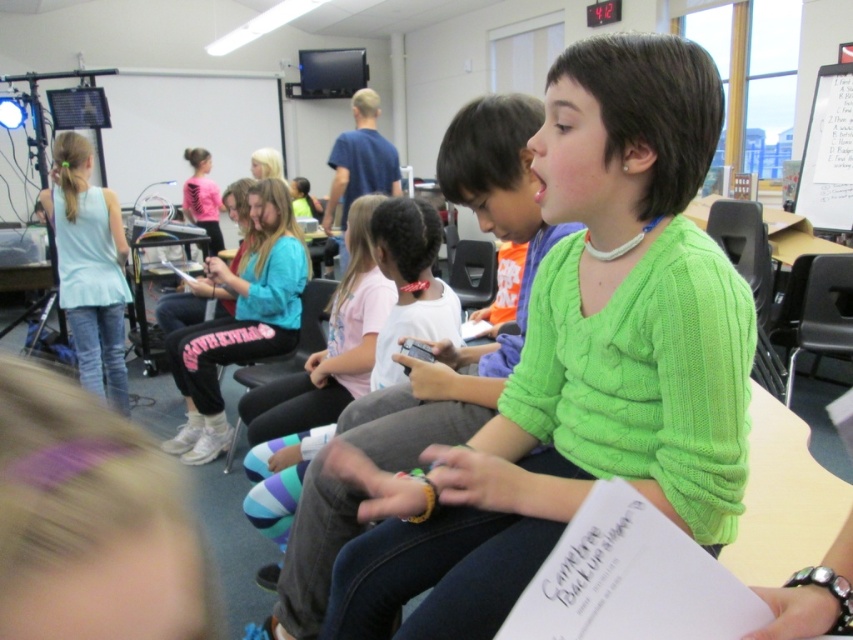
Is point (91, 326) less distant than point (364, 166)?

Yes, point (91, 326) is closer to viewer.

Who is more forward, (99, 272) or (337, 182)?

Point (99, 272) is more forward.

Which is behind, point (68, 296) or point (334, 156)?

Point (334, 156)

What are the coordinates of `light blue fabric shirt at left` in the screenshot? It's located at (90, 268).

Which is in front, point (733, 493) or point (196, 449)?

Positioned in front is point (733, 493).

Is point (360, 593) closer to camera compared to point (247, 355)?

Yes, point (360, 593) is closer to viewer.

What do you see at coordinates (579, 362) in the screenshot?
I see `green knitted sweater at center` at bounding box center [579, 362].

At what (x,y) coordinates should I click in order to perform the action: click on green knitted sweater at center. Please return your answer as a coordinate pair (x, y). This screenshot has width=853, height=640. Looking at the image, I should click on (579, 362).

Locate an element on the screen. green knitted sweater at center is located at coordinates (579, 362).

Does point (714, 349) come farther from viewer compared to point (325, 212)?

No, (714, 349) is in front of (325, 212).

Find the location of a particular element. The width and height of the screenshot is (853, 640). green knitted sweater at center is located at coordinates (579, 362).